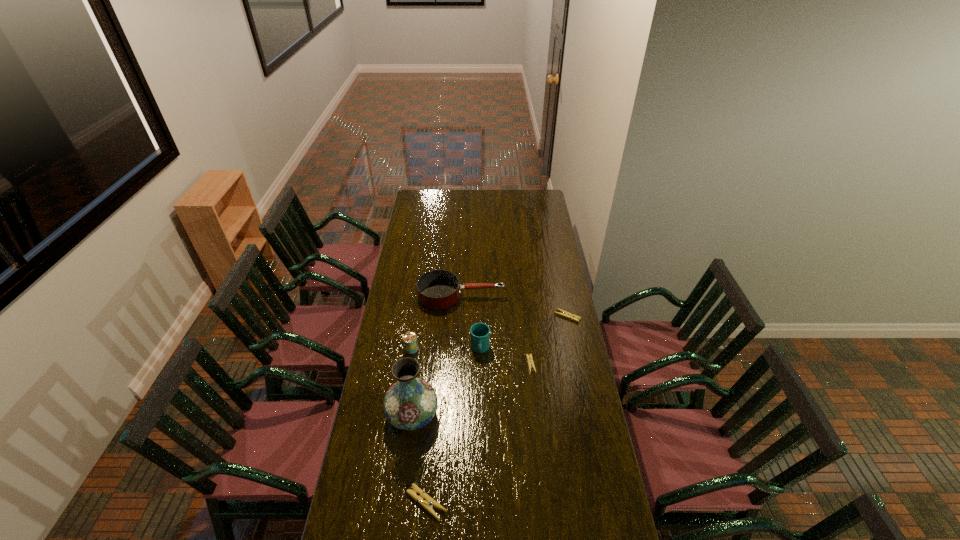
Identify which clothespin is located as the second nearest to the second object from right to left. Please provide its 2D coordinates. Your answer should be formatted as a tuple, i.e. [(x, y)], where the tuple contains the x and y coordinates of a point satisfying the conditions above.

[(424, 500)]